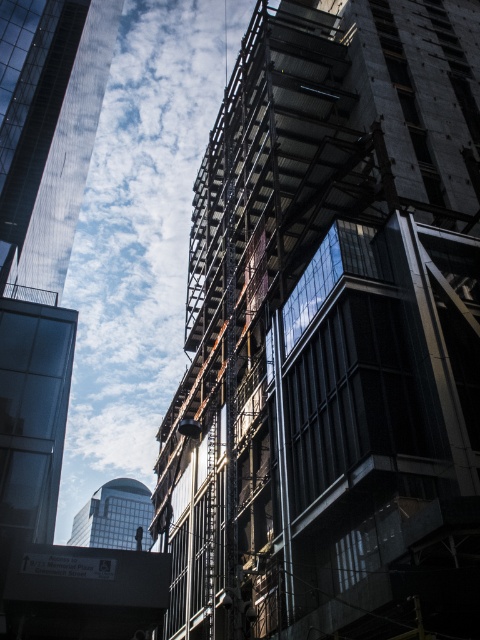
Question: Is transparent glass skyscraper at left further to the viewer compared to matte glass tower at center?

Choices:
 (A) no
 (B) yes

Answer: (A)

Question: Can you confirm if transparent glass skyscraper at left is thinner than matte glass tower at center?

Choices:
 (A) yes
 (B) no

Answer: (A)

Question: Is concrete scaffolding at center to the right of matte glass tower at center from the viewer's perspective?

Choices:
 (A) no
 (B) yes

Answer: (B)

Question: Which point is closer to the camera taking this photo?

Choices:
 (A) 60,280
 (B) 336,36
 (C) 142,499

Answer: (B)

Question: Which object appears closest to the camera in this image?

Choices:
 (A) transparent glass skyscraper at left
 (B) concrete scaffolding at center

Answer: (B)

Question: Which object is closer to the camera taking this photo?

Choices:
 (A) transparent glass skyscraper at left
 (B) concrete scaffolding at center
 (C) matte glass tower at center

Answer: (B)